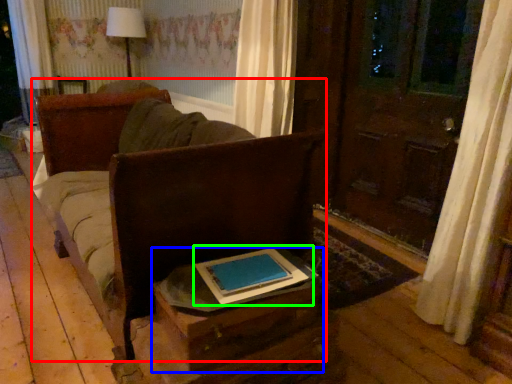
Question: Which is nearer to the furniture (highlighted by a red box)? table (highlighted by a blue box) or book (highlighted by a green box).

Choices:
 (A) table
 (B) book

Answer: (A)